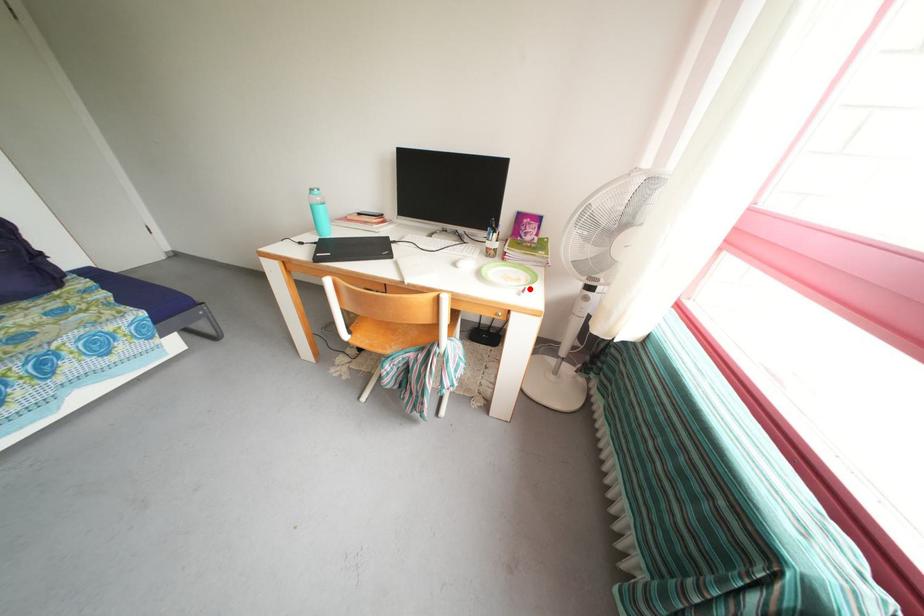
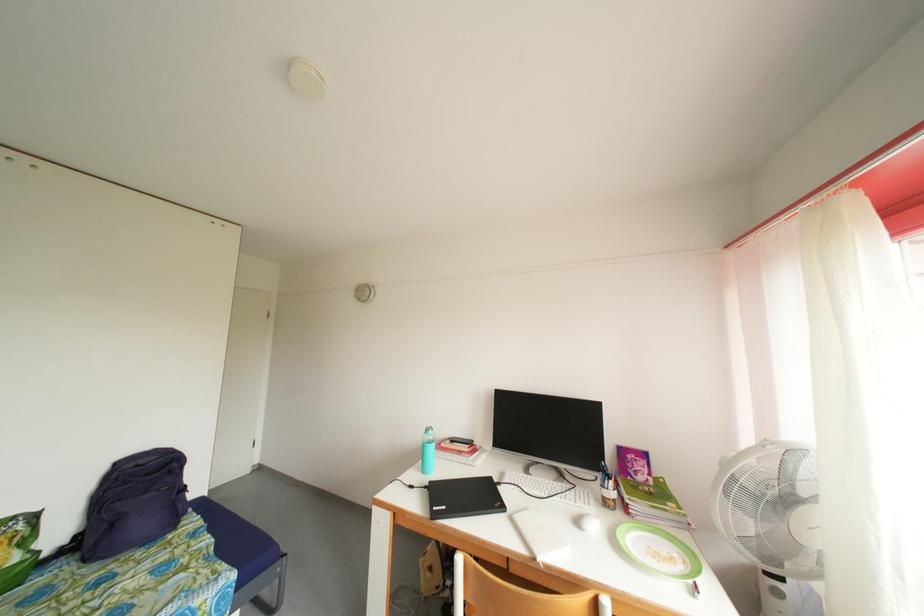
The point at the highlighted location is marked in the first image. Where is the corresponding point in the second image?

(688, 573)